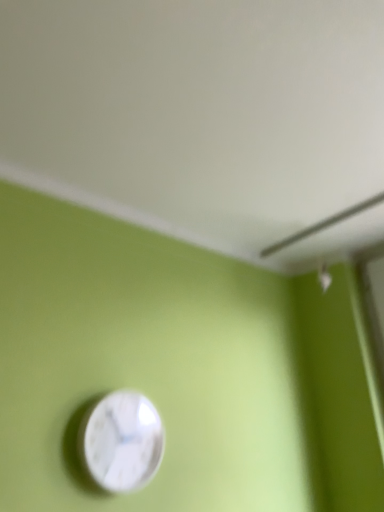
Describe the element at coordinates (121, 441) in the screenshot. I see `white glossy wall clock at lower left` at that location.

Where is `white glossy wall clock at lower left`? Image resolution: width=384 pixels, height=512 pixels. white glossy wall clock at lower left is located at coordinates (121, 441).

Where is `white glossy wall clock at lower left`? The width and height of the screenshot is (384, 512). white glossy wall clock at lower left is located at coordinates (121, 441).